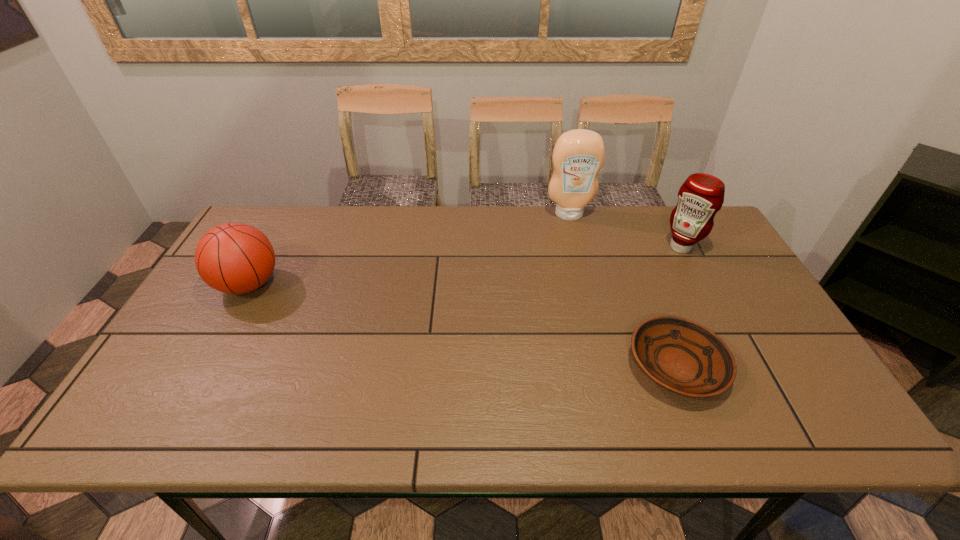
Identify the location of object that ranks as the third closest to the shortest object. The height and width of the screenshot is (540, 960). (234, 258).

You are a GUI agent. You are given a task and a screenshot of the screen. Output one action in this format:
    pyautogui.click(x=<x>, y=<y>)
    Task: Click on the vacant space that satisfies the following two spatial constraints: 1. on the label of the farthest object; 2. on the right side of the shortest object
    
    Given the screenshot: What is the action you would take?
    pyautogui.click(x=608, y=366)

Locate an element on the screen. vacant space that satisfies the following two spatial constraints: 1. on the label of the shorter condiment; 2. on the right side of the farthest object is located at coordinates (578, 247).

You are a GUI agent. You are given a task and a screenshot of the screen. Output one action in this format:
    pyautogui.click(x=<x>, y=<y>)
    Task: Click on the vacant space that satisfies the following two spatial constraints: 1. on the label of the farther condiment; 2. on the right side of the shortest object
    The image size is (960, 540).
    Given the screenshot: What is the action you would take?
    pyautogui.click(x=608, y=366)

Where is `free point that satisfies the following two spatial constraints: 1. on the label of the left condiment; 2. on the left side of the right condiment`? free point that satisfies the following two spatial constraints: 1. on the label of the left condiment; 2. on the left side of the right condiment is located at coordinates (578, 247).